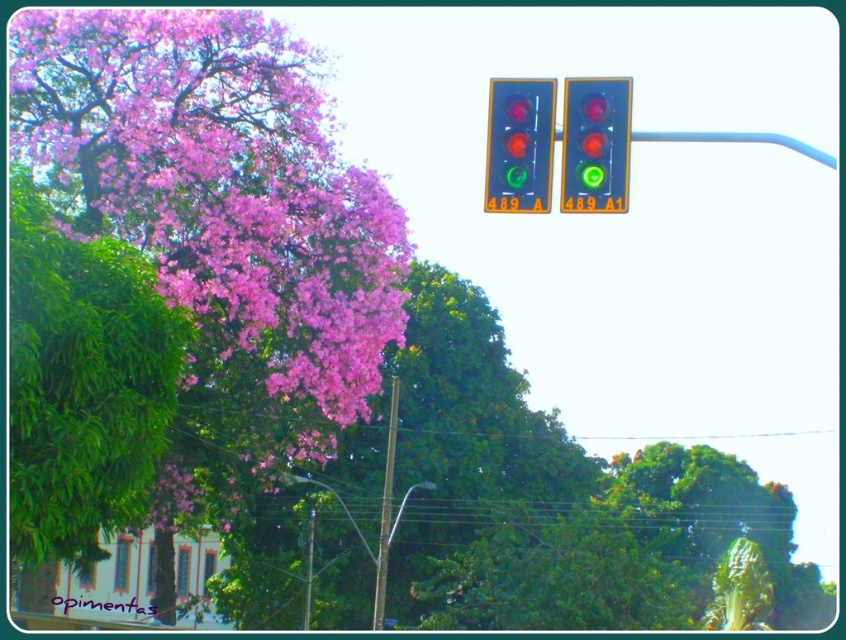
Question: Is the position of metallic pole at lower center less distant than that of metallic pole at center?

Choices:
 (A) yes
 (B) no

Answer: (A)

Question: Which point is closer to the camera?

Choices:
 (A) matte black traffic light at upper center
 (B) metallic pole at center
 (C) green leafy tree at left

Answer: (A)

Question: Does green leafy tree at left have a larger size compared to metallic pole at center?

Choices:
 (A) yes
 (B) no

Answer: (A)

Question: Is pink matte flower at upper left below metallic pole at lower center?

Choices:
 (A) no
 (B) yes

Answer: (A)

Question: Among these points, which one is nearest to the camera?

Choices:
 (A) (279, 36)
 (B) (570, 77)
 (C) (64, 513)

Answer: (B)

Question: Based on their relative distances, which object is nearer to the green leafy tree at left?

Choices:
 (A) metallic pole at lower center
 (B) matte black traffic light at upper center
 (C) matte glass traffic light at upper right
 (D) metallic pole at center

Answer: (B)